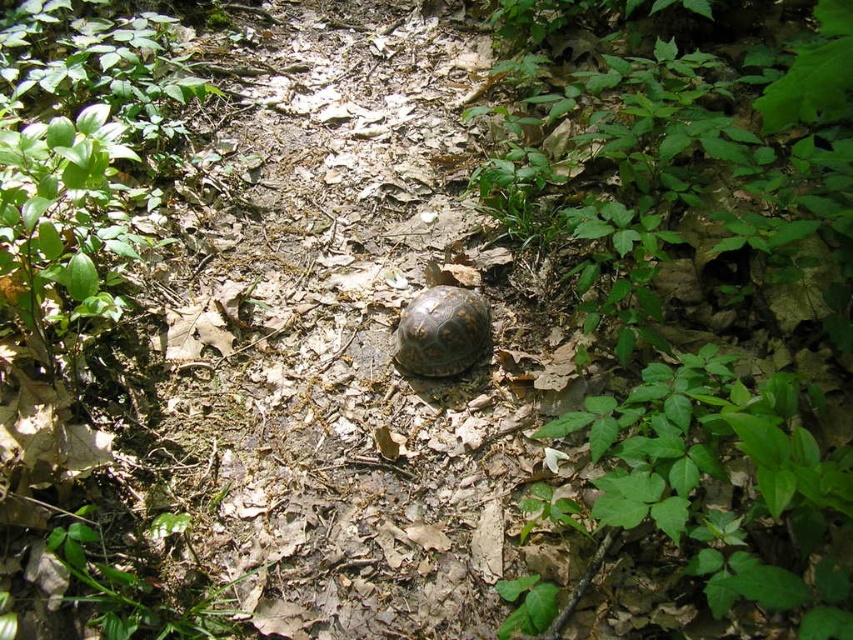
Question: Is green leafy plant at center further to camera compared to brown textured tortoise at center?

Choices:
 (A) yes
 (B) no

Answer: (B)

Question: Which point is farther to the camera?

Choices:
 (A) green leafy plant at center
 (B) brown textured tortoise at center

Answer: (B)

Question: Which of the following is the closest to the observer?

Choices:
 (A) (662, 492)
 (B) (471, 332)

Answer: (A)

Question: Is green leafy plant at center positioned before brown textured tortoise at center?

Choices:
 (A) no
 (B) yes

Answer: (B)

Question: Which object is closer to the camera taking this photo?

Choices:
 (A) green leafy plant at center
 (B) brown textured tortoise at center

Answer: (A)

Question: Is green leafy plant at center to the right of brown textured tortoise at center from the viewer's perspective?

Choices:
 (A) yes
 (B) no

Answer: (A)